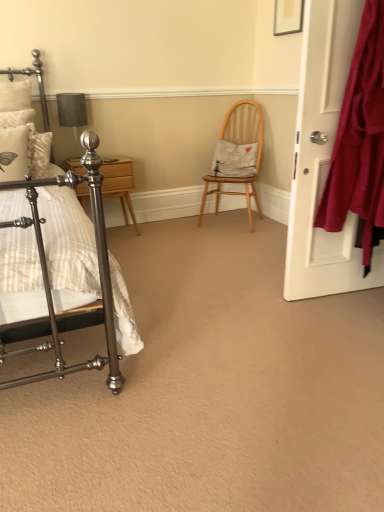
Question: From the image's perspective, is wooden chair at center over matte gray fabric at upper left?

Choices:
 (A) yes
 (B) no

Answer: (B)

Question: Would you consider wooden chair at center to be distant from matte gray fabric at upper left?

Choices:
 (A) yes
 (B) no

Answer: (A)

Question: Can you confirm if wooden chair at center is wider than matte gray fabric at upper left?

Choices:
 (A) yes
 (B) no

Answer: (A)

Question: Can matte gray fabric at upper left be found inside wooden chair at center?

Choices:
 (A) yes
 (B) no

Answer: (B)

Question: Is wooden chair at center looking in the opposite direction of matte gray fabric at upper left?

Choices:
 (A) yes
 (B) no

Answer: (B)

Question: Considering the relative sizes of wooden chair at center and matte gray fabric at upper left in the image provided, is wooden chair at center shorter than matte gray fabric at upper left?

Choices:
 (A) no
 (B) yes

Answer: (A)

Question: Considering the relative sizes of matte white door at right and white fabric pillow at center, marked as the first pillow in a right-to-left arrangement, in the image provided, is matte white door at right bigger than white fabric pillow at center, marked as the first pillow in a right-to-left arrangement,?

Choices:
 (A) yes
 (B) no

Answer: (A)

Question: Is matte white door at right to the right of white fabric pillow at center, which is counted as the second pillow, starting from the front, from the viewer's perspective?

Choices:
 (A) yes
 (B) no

Answer: (A)

Question: Considering the relative sizes of matte white door at right and white fabric pillow at center, marked as the first pillow in a right-to-left arrangement, in the image provided, is matte white door at right shorter than white fabric pillow at center, marked as the first pillow in a right-to-left arrangement,?

Choices:
 (A) no
 (B) yes

Answer: (A)

Question: Is matte white door at right outside white fabric pillow at center, which is counted as the second pillow, starting from the front?

Choices:
 (A) yes
 (B) no

Answer: (A)

Question: Does matte white door at right have a greater width compared to white fabric pillow at center, which is counted as the second pillow, starting from the front?

Choices:
 (A) yes
 (B) no

Answer: (B)

Question: Is matte white door at right in front of white fabric pillow at center, which is the second pillow in left-to-right order?

Choices:
 (A) yes
 (B) no

Answer: (A)

Question: Is white fabric pillow at center, which is counted as the second pillow, starting from the front, wider than matte gray fabric at upper left?

Choices:
 (A) yes
 (B) no

Answer: (A)